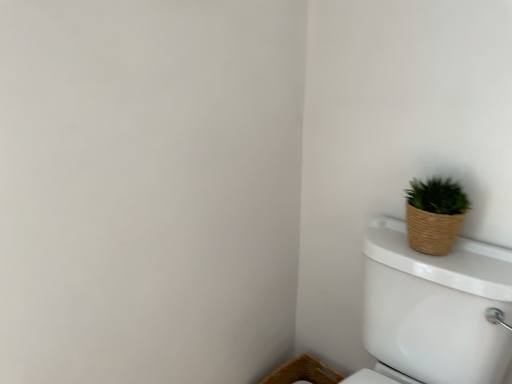
The height and width of the screenshot is (384, 512). What do you see at coordinates (304, 372) in the screenshot? I see `brown woven basket at lower right` at bounding box center [304, 372].

What is the approximate height of brown woven basket at lower right?

brown woven basket at lower right is 7.00 inches tall.

Where is `brown woven basket at lower right`? brown woven basket at lower right is located at coordinates (304, 372).

The height and width of the screenshot is (384, 512). Identify the location of brown woven basket at lower right. (304, 372).